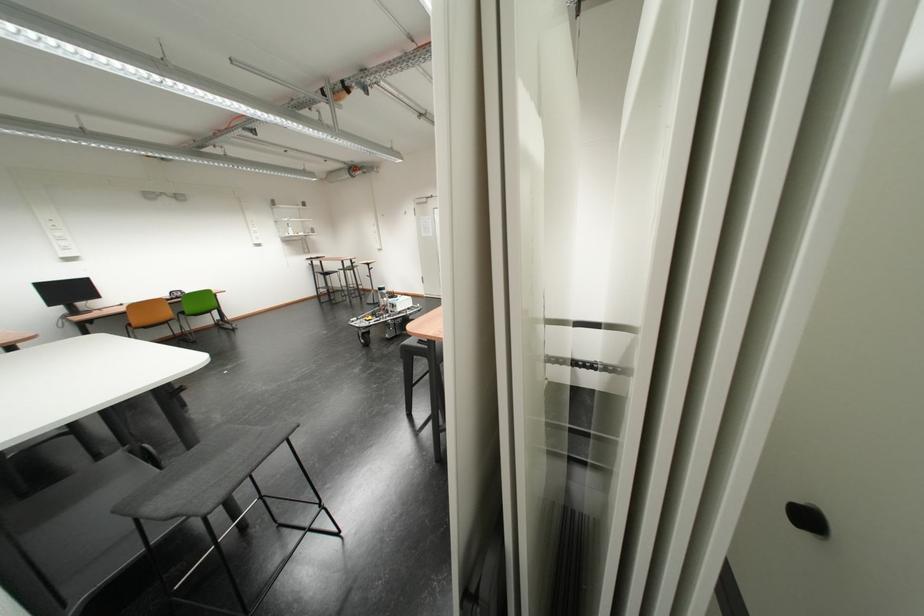
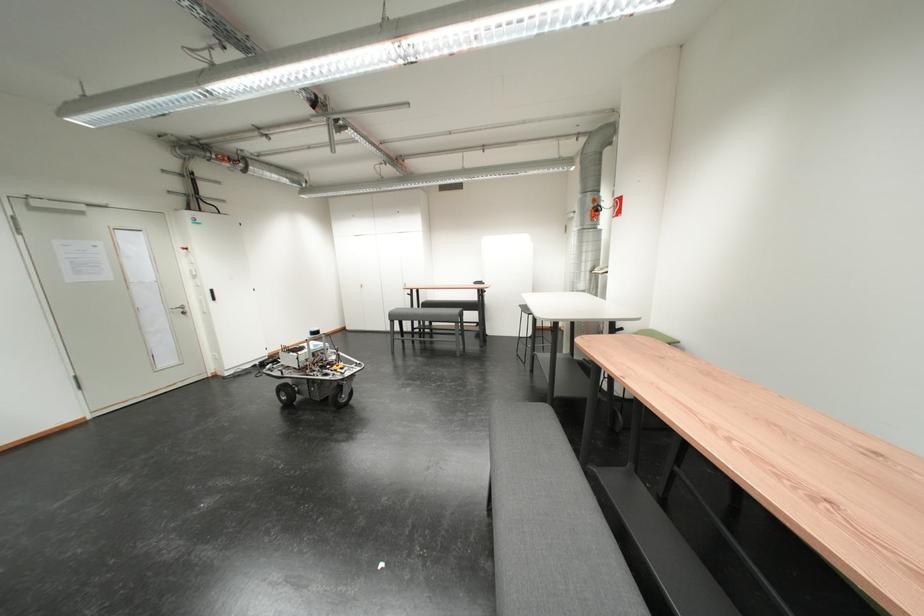
In the second image, find the point that corresponds to (x=258, y=419) in the first image.

(494, 419)